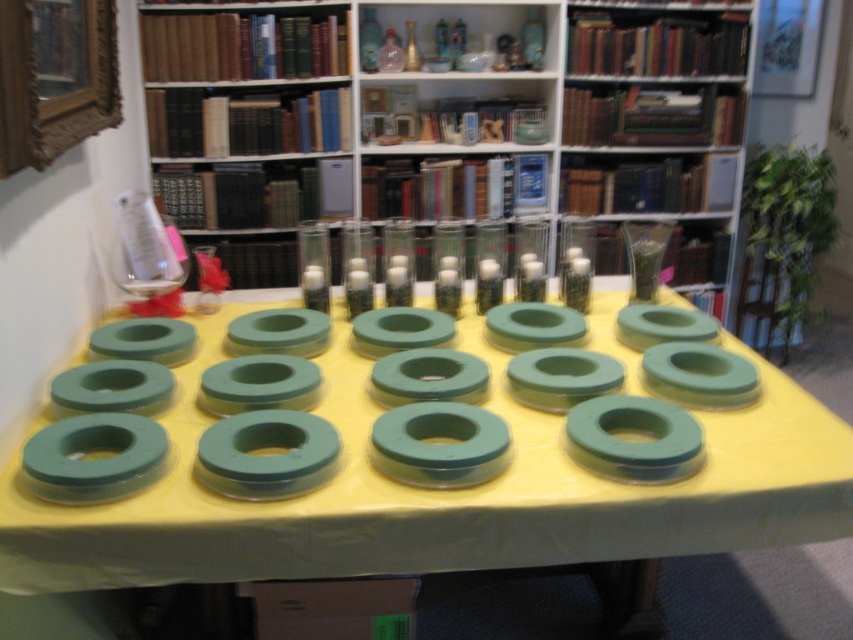
Who is taller, wooden bookshelf at upper center or green rubber rings at center?

wooden bookshelf at upper center

I want to click on wooden bookshelf at upper center, so 451,124.